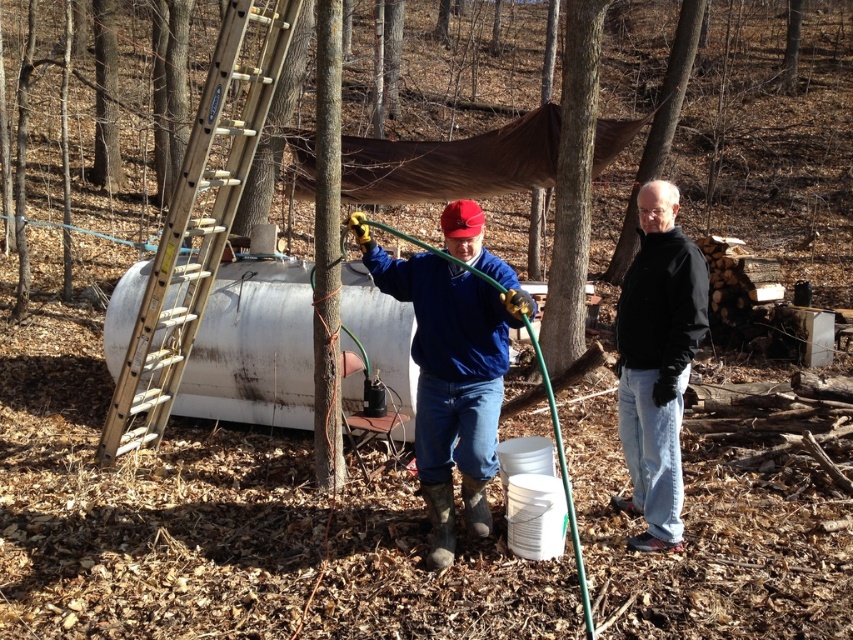
You are a hiker who has just entered the woods and see the wooden ladder at left and the black matte jacket at center. Which object is closer to your current position?

The wooden ladder at left is closer to your current position because it is to the left of the black matte jacket at center, meaning it is positioned nearer to the hiker.